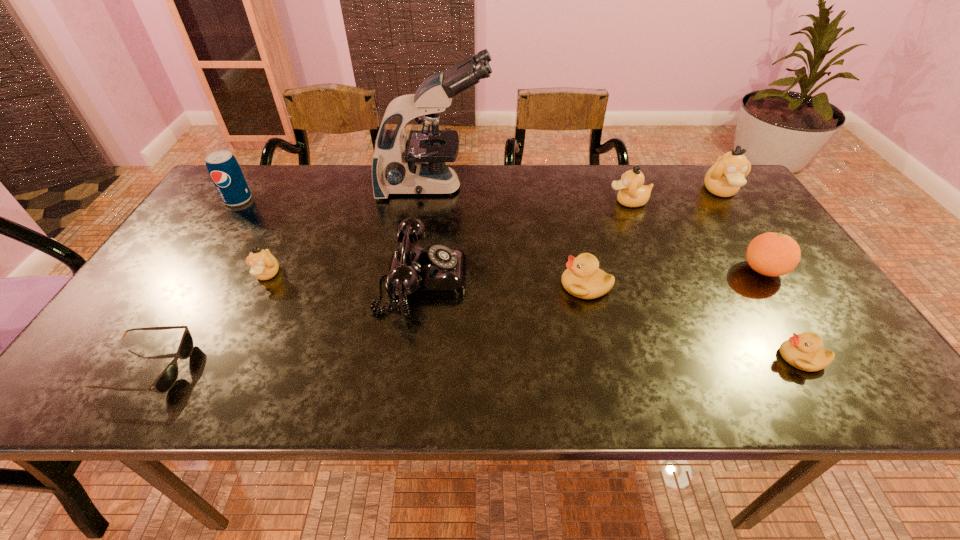
In order to click on the smallest tan duckling in this screenshot , I will do `click(264, 266)`.

Where is `the leftmost duckling`? the leftmost duckling is located at coordinates (264, 266).

Locate an element on the screen. The width and height of the screenshot is (960, 540). the right yellow duckling is located at coordinates (804, 351).

The width and height of the screenshot is (960, 540). What are the coordinates of `the ninth tallest object` in the screenshot? It's located at (804, 351).

This screenshot has height=540, width=960. Find the location of `sunglasses`. sunglasses is located at coordinates (165, 381).

This screenshot has width=960, height=540. Find the location of `free space located 0.170m through the eyepieces of the microscope`. free space located 0.170m through the eyepieces of the microscope is located at coordinates (545, 187).

Identify the location of free space located on the face of the biggest tan duckling. (743, 225).

Find the location of `vacant position located on the right of the blue pop`. vacant position located on the right of the blue pop is located at coordinates (366, 200).

In order to click on vacant space located 0.070m on the dial of the black telephone in this screenshot , I will do `click(494, 280)`.

The width and height of the screenshot is (960, 540). I want to click on vacant space located on the face of the second biggest tan duckling, so click(554, 202).